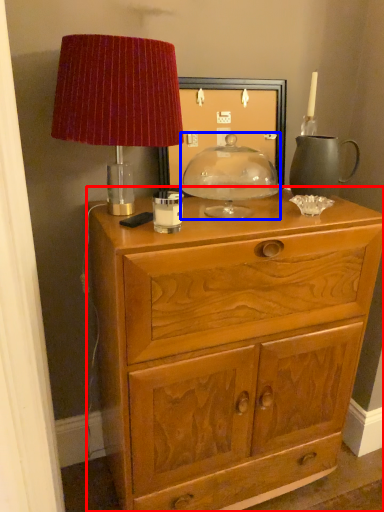
Question: Which point is further to the camera, chest of drawers (highlighted by a red box) or candle holder (highlighted by a blue box)?

Choices:
 (A) chest of drawers
 (B) candle holder

Answer: (B)